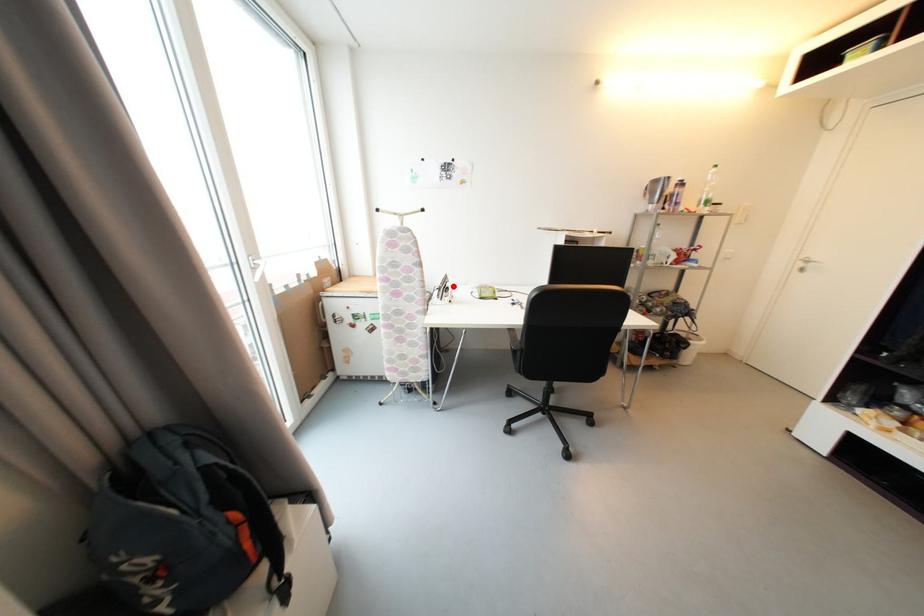
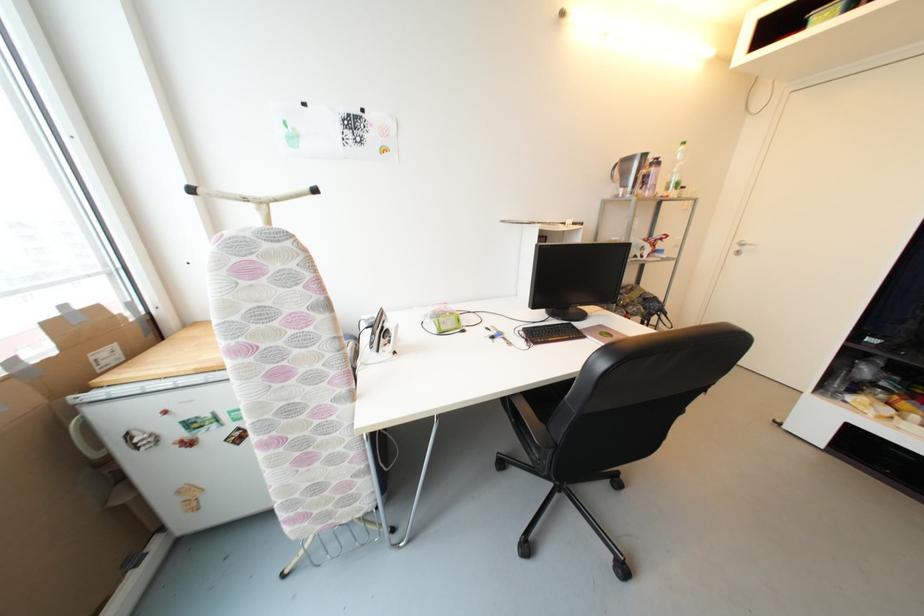
Locate, in the second image, the point that corresponds to the highlighted location in the first image.

(393, 328)